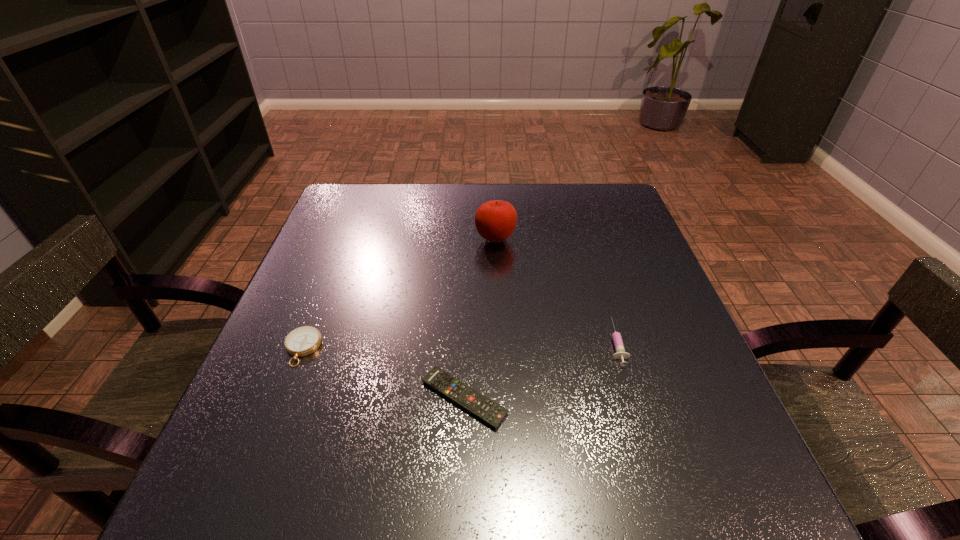
You are a GUI agent. You are given a task and a screenshot of the screen. Output one action in this format:
    pyautogui.click(x=<x>, y=<y>)
    Task: Click on the apple
    This screenshot has height=540, width=960.
    Given the screenshot: What is the action you would take?
    pyautogui.click(x=495, y=221)

The width and height of the screenshot is (960, 540). I want to click on the tallest object, so click(495, 221).

What are the coordinates of `the second tallest object` in the screenshot? It's located at pos(620,353).

The image size is (960, 540). I want to click on syringe, so click(x=620, y=353).

Image resolution: width=960 pixels, height=540 pixels. What are the coordinates of `the third tallest object` in the screenshot? It's located at (304, 340).

Locate an element on the screen. the leftmost object is located at coordinates (304, 340).

Locate an element on the screen. The height and width of the screenshot is (540, 960). the nearest object is located at coordinates (490, 412).

Find the location of `remote control`. remote control is located at coordinates (490, 412).

Find the location of a particular element. vacant space situated on the left of the tallest object is located at coordinates (345, 239).

Find the location of a particular element. vacant region located on the back of the rightmost object is located at coordinates (591, 262).